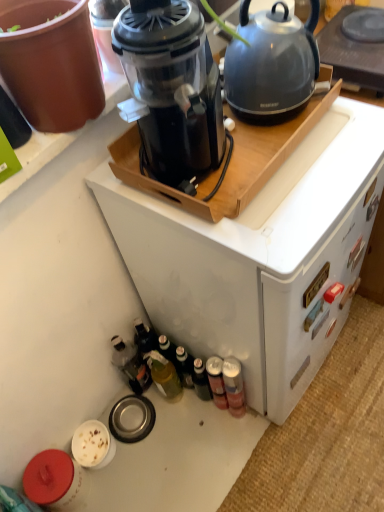
Question: Is black plastic blender at upper center surrounding metallic silver can at lower right, the first bottle positioned from the right?

Choices:
 (A) no
 (B) yes

Answer: (A)

Question: Is black plastic blender at upper center not near metallic silver can at lower right, which is the 4th bottle from left to right?

Choices:
 (A) no
 (B) yes

Answer: (A)

Question: Does black plastic blender at upper center have a greater width compared to metallic silver can at lower right, the first bottle positioned from the right?

Choices:
 (A) yes
 (B) no

Answer: (A)

Question: Can you confirm if black plastic blender at upper center is smaller than metallic silver can at lower right, the first bottle positioned from the right?

Choices:
 (A) no
 (B) yes

Answer: (A)

Question: Is the position of black plastic blender at upper center less distant than that of metallic silver can at lower right, the first bottle positioned from the right?

Choices:
 (A) no
 (B) yes

Answer: (B)

Question: Considering the positions of matte gray kettle at upper right and black plastic blender at upper center in the image, is matte gray kettle at upper right wider or thinner than black plastic blender at upper center?

Choices:
 (A) thin
 (B) wide

Answer: (A)

Question: From their relative heights in the image, would you say matte gray kettle at upper right is taller or shorter than black plastic blender at upper center?

Choices:
 (A) short
 (B) tall

Answer: (A)

Question: Visually, is matte gray kettle at upper right positioned to the left or to the right of black plastic blender at upper center?

Choices:
 (A) right
 (B) left

Answer: (A)

Question: Does point (372, 53) appear closer or farther from the camera than point (172, 19)?

Choices:
 (A) farther
 (B) closer

Answer: (A)

Question: In terms of size, does black plastic blender at upper center appear bigger or smaller than translucent plastic bottle at lower left, which is counted as the first bottle, starting from the left?

Choices:
 (A) big
 (B) small

Answer: (A)

Question: Is black plastic blender at upper center in front of or behind translucent plastic bottle at lower left, which is counted as the first bottle, starting from the left, in the image?

Choices:
 (A) front
 (B) behind

Answer: (A)

Question: From the image's perspective, is black plastic blender at upper center located above or below translucent plastic bottle at lower left, which is counted as the first bottle, starting from the left?

Choices:
 (A) below
 (B) above

Answer: (B)

Question: Considering the positions of black plastic blender at upper center and translucent plastic bottle at lower left, which is counted as the first bottle, starting from the left, in the image, is black plastic blender at upper center wider or thinner than translucent plastic bottle at lower left, which is counted as the first bottle, starting from the left,?

Choices:
 (A) thin
 (B) wide

Answer: (B)

Question: From the image's perspective, is translucent glass bottle at lower center, the 2th bottle positioned from the left, positioned above or below metallic gray kettle at upper right?

Choices:
 (A) above
 (B) below

Answer: (B)

Question: Would you say translucent glass bottle at lower center, which is the 3th bottle from right to left, is to the left or to the right of metallic gray kettle at upper right in the picture?

Choices:
 (A) left
 (B) right

Answer: (A)